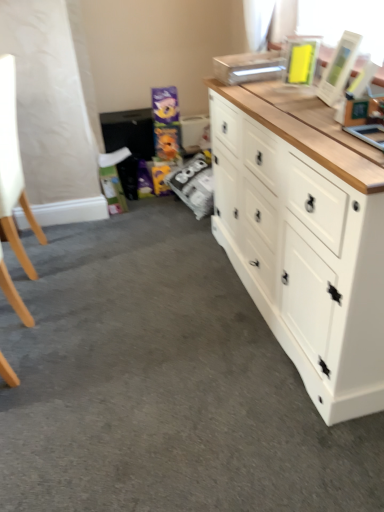
Question: Is white leather swivel chair at left in front of white wood chest of drawers at right?

Choices:
 (A) no
 (B) yes

Answer: (A)

Question: Is white leather swivel chair at left in contact with white wood chest of drawers at right?

Choices:
 (A) no
 (B) yes

Answer: (A)

Question: Is white wood chest of drawers at right inside white leather swivel chair at left?

Choices:
 (A) no
 (B) yes

Answer: (A)

Question: From a real-world perspective, is white leather swivel chair at left physically above white wood chest of drawers at right?

Choices:
 (A) yes
 (B) no

Answer: (A)

Question: From the image's perspective, is white leather swivel chair at left beneath white wood chest of drawers at right?

Choices:
 (A) yes
 (B) no

Answer: (B)

Question: Is there a large distance between white leather swivel chair at left and white wood chest of drawers at right?

Choices:
 (A) no
 (B) yes

Answer: (B)

Question: Does white wood chest of drawers at right turn towards white leather swivel chair at left?

Choices:
 (A) no
 (B) yes

Answer: (B)

Question: From a real-world perspective, is white wood chest of drawers at right positioned over white leather swivel chair at left based on gravity?

Choices:
 (A) no
 (B) yes

Answer: (A)

Question: Does white wood chest of drawers at right appear on the right side of white leather swivel chair at left?

Choices:
 (A) yes
 (B) no

Answer: (A)

Question: Considering the relative sizes of white wood chest of drawers at right and white leather swivel chair at left in the image provided, is white wood chest of drawers at right thinner than white leather swivel chair at left?

Choices:
 (A) yes
 (B) no

Answer: (B)

Question: Is white wood chest of drawers at right turned away from white leather swivel chair at left?

Choices:
 (A) yes
 (B) no

Answer: (B)

Question: Does white wood chest of drawers at right appear on the left side of white leather swivel chair at left?

Choices:
 (A) no
 (B) yes

Answer: (A)

Question: Is white leather swivel chair at left taller or shorter than white wood chest of drawers at right?

Choices:
 (A) tall
 (B) short

Answer: (A)